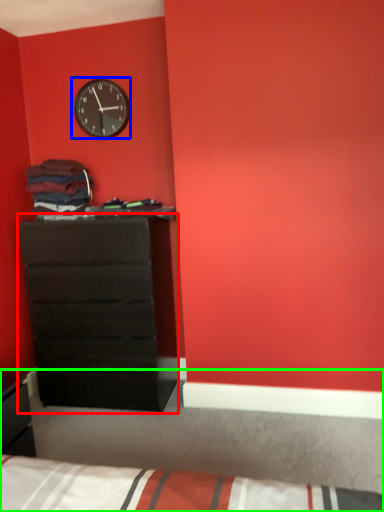
Question: Considering the real-world distances, which object is farthest from chest of drawers (highlighted by a red box)? wall clock (highlighted by a blue box) or bed (highlighted by a green box)?

Choices:
 (A) wall clock
 (B) bed

Answer: (B)